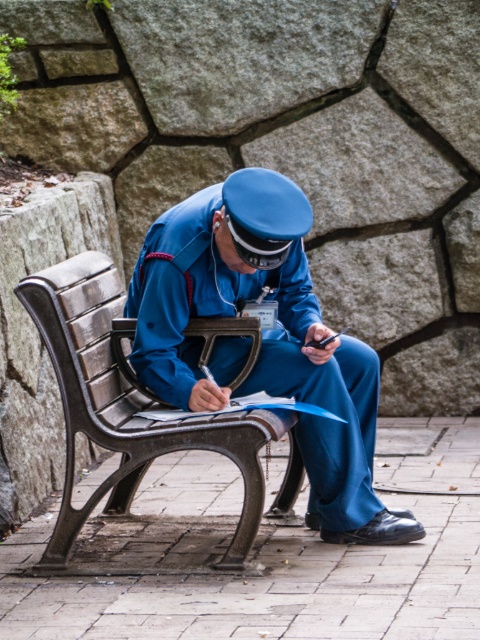
Where is the blue uniform at center located in the image?

The blue uniform at center is located at point coordinates of (x=264, y=340) in the image.

You are a visitor at this location and need to determine if the blue uniform at center is taller than the wooden bench at center. Based on the scene description, can you confirm this?

The blue uniform at center has a greater height compared to the wooden bench at center, so yes, the blue uniform at center is taller than the wooden bench at center.